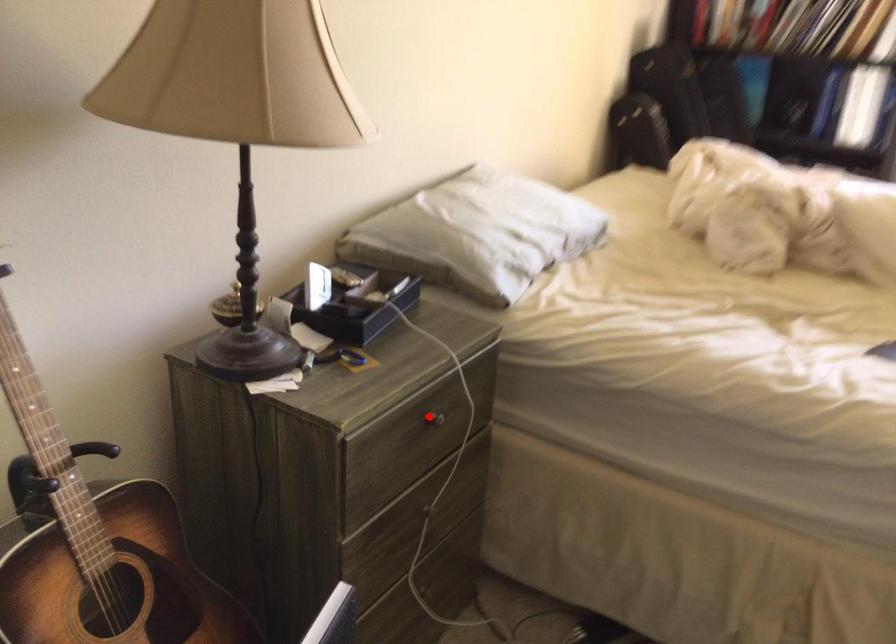
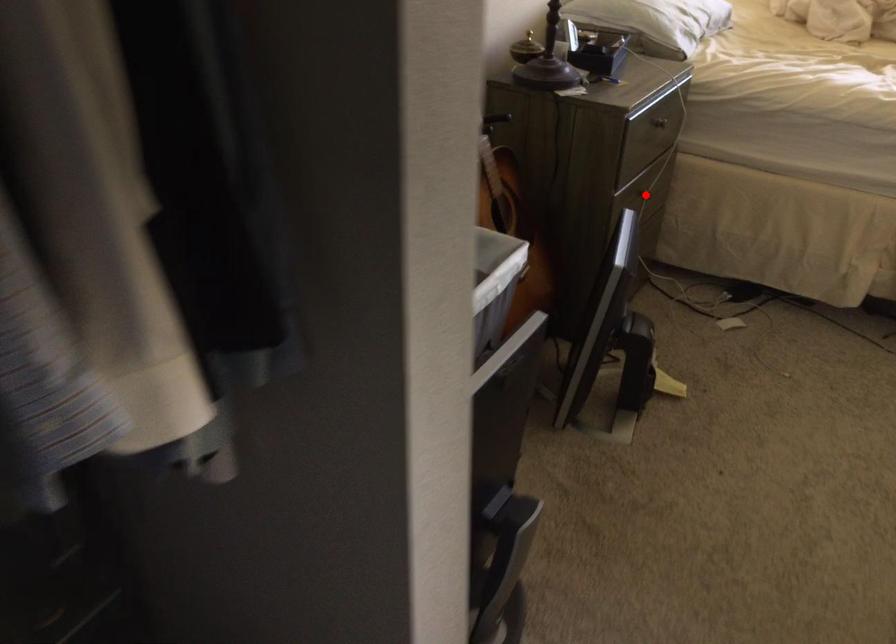
I am providing you with two images of the same scene from different viewpoints. A red point is marked on the first image and another point is marked on the second image. Is the red point in image1 aligned with the point shown in image2?

No